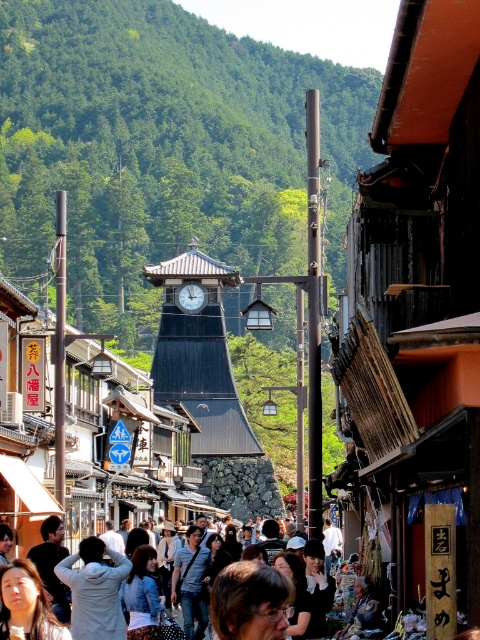
Question: Does light brown hair at center have a lesser width compared to matte black clock tower at center?

Choices:
 (A) yes
 (B) no

Answer: (B)

Question: Can you confirm if dark wood clock tower at center is positioned to the left of matte black clock tower at center?

Choices:
 (A) yes
 (B) no

Answer: (B)

Question: Which is nearer to the light brown hair at center?

Choices:
 (A) matte black clock tower at center
 (B) dark wood clock tower at center

Answer: (B)

Question: Among these objects, which one is farthest from the camera?

Choices:
 (A) matte black clock tower at center
 (B) dark wood clock tower at center

Answer: (A)

Question: Which of the following is the closest to the observer?

Choices:
 (A) dark wood clock tower at center
 (B) light brown hair at center
 (C) matte black clock tower at center

Answer: (B)

Question: Does dark wood clock tower at center have a lesser width compared to light brown hair at center?

Choices:
 (A) no
 (B) yes

Answer: (A)